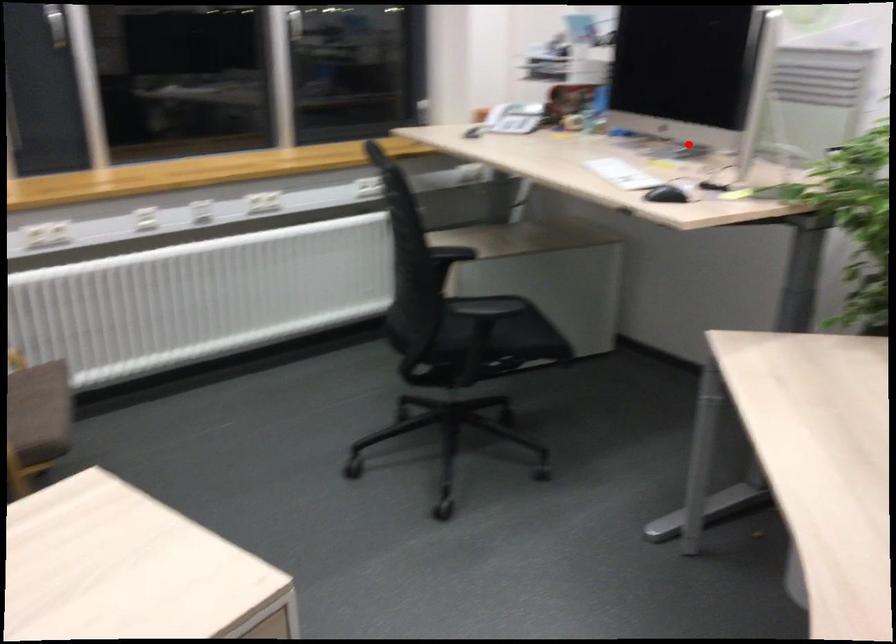
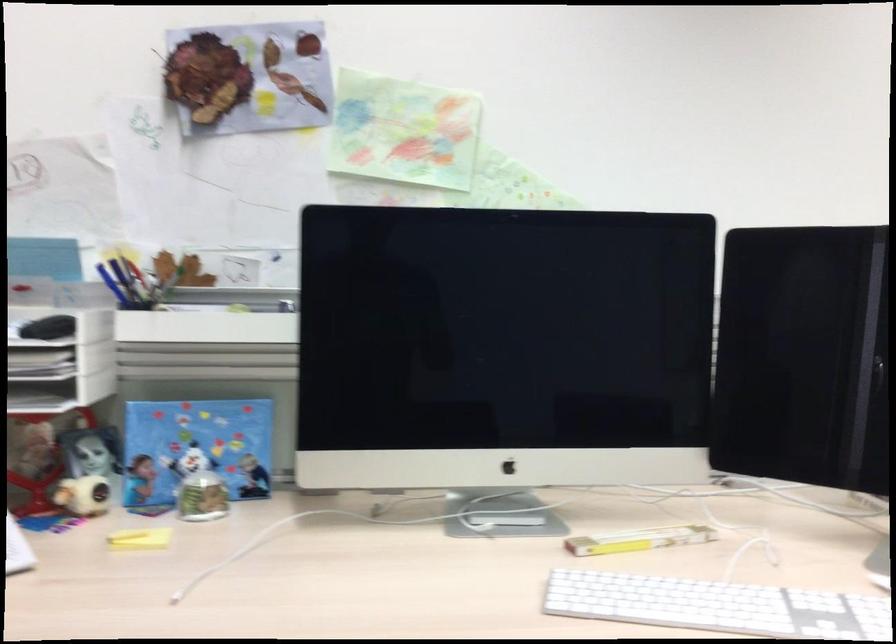
Question: A red point is marked in image1. In image2, is the corresponding 3D point closer to the camera or farther? Reply with the corresponding letter.

Choices:
 (A) The corresponding 3D point is closer.
 (B) The corresponding 3D point is farther.

Answer: (A)